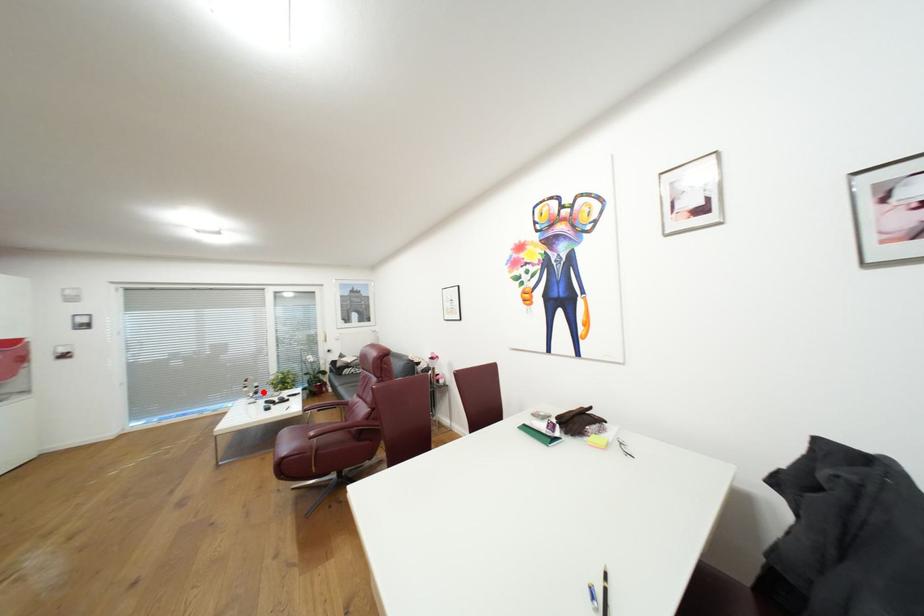
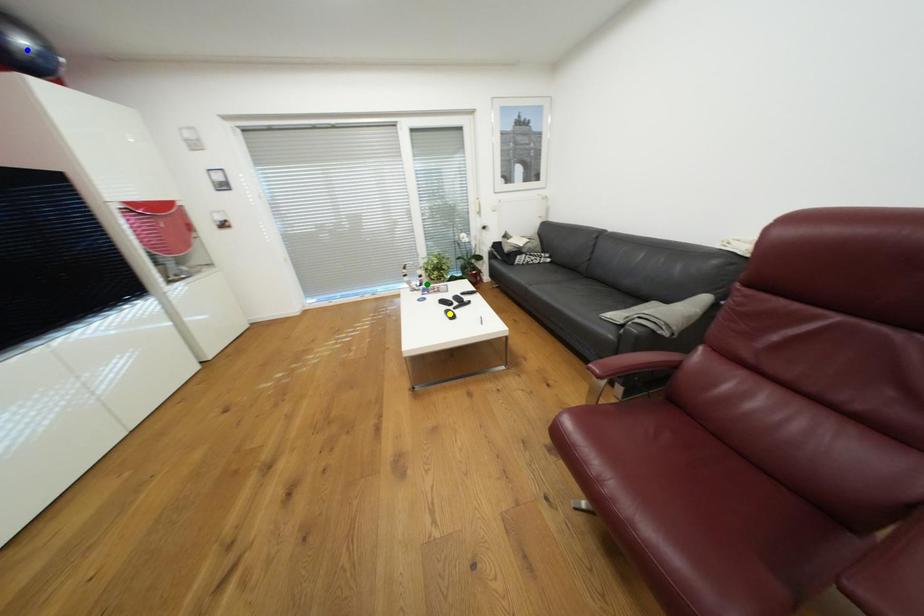
Question: I am providing you with two images of the same scene from different viewpoints. A red point is marked on the first image. You are given multiple points on the second image. Can you choose the point in image 2 that corresponds to the point in image 1?

Choices:
 (A) blue point
 (B) yellow point
 (C) green point

Answer: (C)